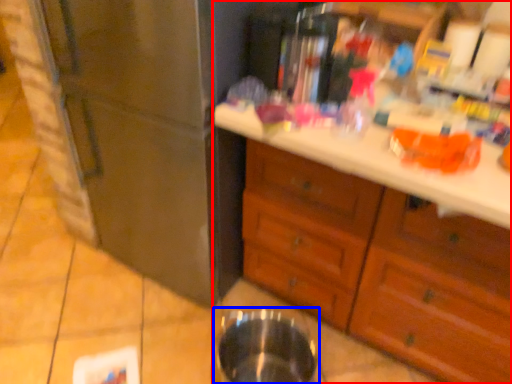
Question: Which point is further to the camera, cabinetry (highlighted by a red box) or basin (highlighted by a blue box)?

Choices:
 (A) cabinetry
 (B) basin

Answer: (B)